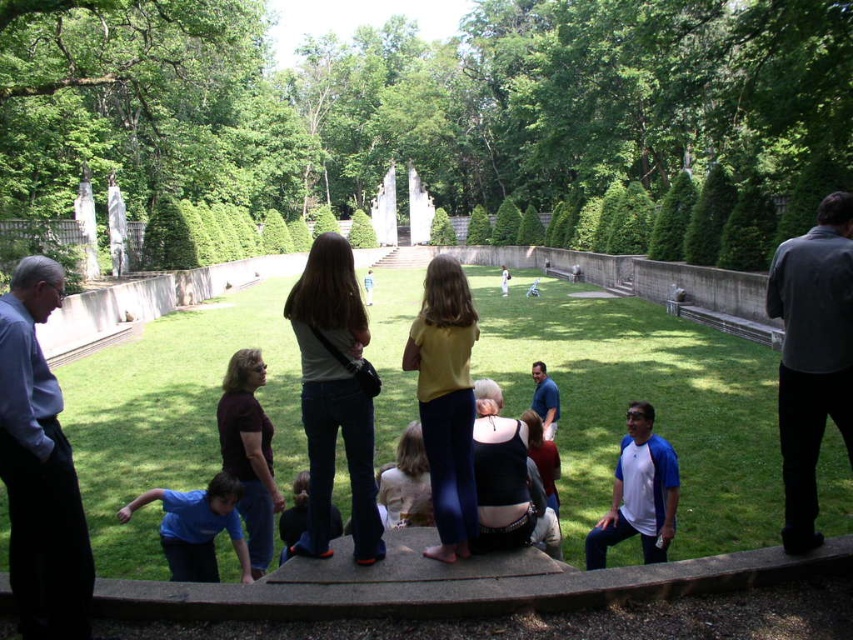
You are a photographer trying to capture a group photo of the dark gray shirt at right and the blue shirt at center. Since you want to ensure both are visible clearly, which person should you focus on first to avoid blurriness?

You should focus on the dark gray shirt at right first because it is larger and more prominent, ensuring clarity before adjusting for the smaller blue shirt at center.

You are standing on the raised stone platform and want to see both the dark gray shirt at right and the blue shirt at center. Which person is blocking your view of the other?

The dark gray shirt at right is positioned over the blue shirt at center, so the dark gray shirt at right is blocking the view of the blue shirt at center.